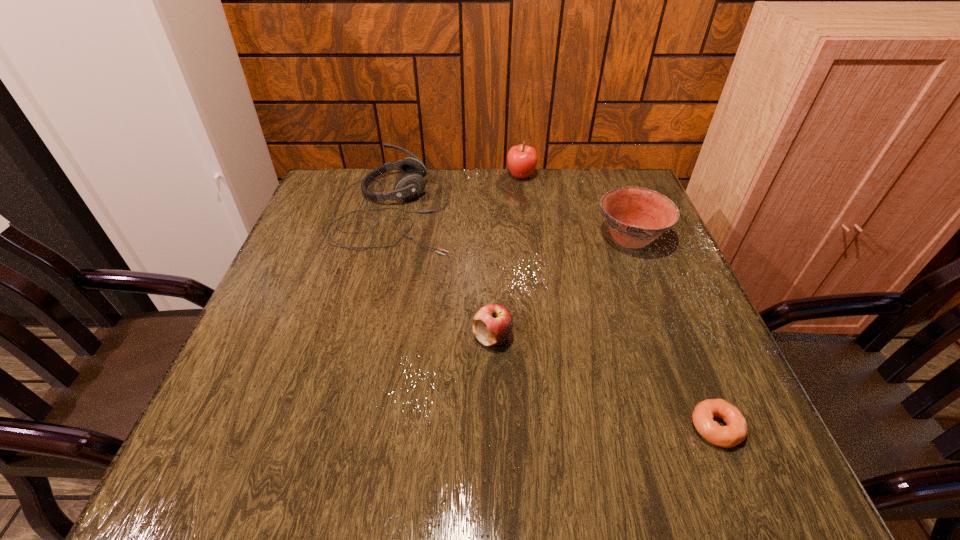
Identify the location of object present at the far left corner. (410, 185).

You are a GUI agent. You are given a task and a screenshot of the screen. Output one action in this format:
    pyautogui.click(x=<x>, y=<y>)
    Task: Click on the object at the far right corner
    
    Given the screenshot: What is the action you would take?
    pyautogui.click(x=636, y=216)

Find the location of `object located in the near right corner section of the desktop`. object located in the near right corner section of the desktop is located at coordinates (736, 429).

This screenshot has height=540, width=960. In the image, there is a desktop. In order to click on vacant space at the far edge in this screenshot , I will do `click(508, 193)`.

At what (x,y) coordinates should I click in order to perform the action: click on free space at the near edge of the desktop. Please return your answer as a coordinate pair (x, y). Looking at the image, I should click on (396, 474).

Identify the location of vacant region at the left edge of the desktop. (310, 309).

Where is `vacant space at the right edge of the desktop`? vacant space at the right edge of the desktop is located at coordinates (682, 324).

At what (x,y) coordinates should I click in order to perform the action: click on vacant region at the far left corner of the desktop. Please return your answer as a coordinate pair (x, y). The image size is (960, 540). Looking at the image, I should click on (315, 210).

Where is `free space at the far right corner of the desktop`? This screenshot has height=540, width=960. free space at the far right corner of the desktop is located at coordinates (585, 186).

Locate an element on the screen. This screenshot has width=960, height=540. empty location between the bowl and the headset is located at coordinates (512, 224).